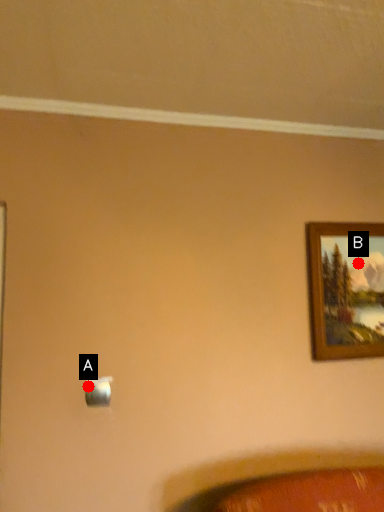
Question: Two points are circled on the image, labeled by A and B beside each circle. Which of the following is the farthest from the observer?

Choices:
 (A) A is further
 (B) B is further

Answer: (B)